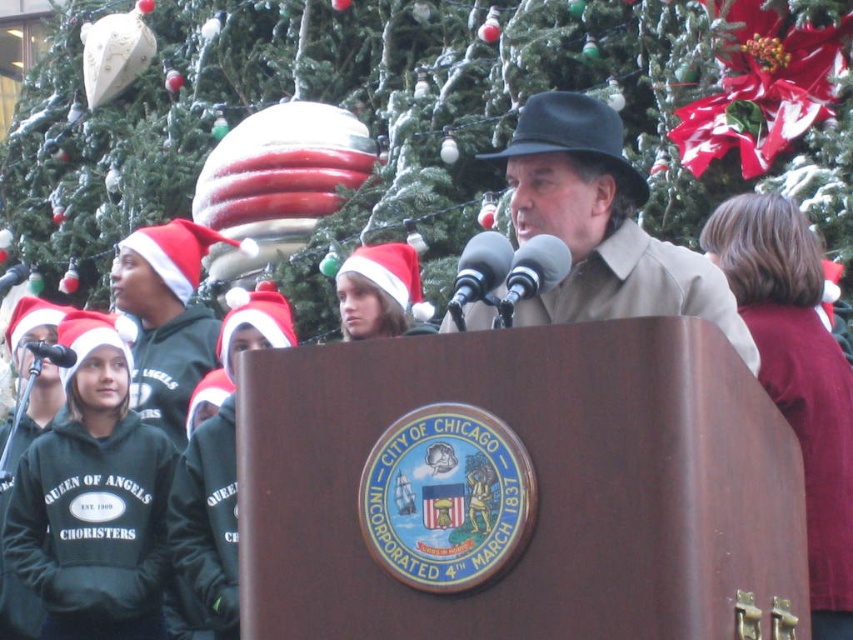
Is point (433, 244) positioned behind point (57, 360)?

Yes, it is.

Between green textured christmas tree at upper center and black matte microphone at left, which one is positioned lower?

black matte microphone at left

Between point (283, 26) and point (39, 346), which one is positioned in front?

Point (39, 346)

Find the location of a particular element. green textured christmas tree at upper center is located at coordinates 347,108.

Who is positioned more to the left, white fabric santa hat at left or black felt hat at center?

Positioned to the left is white fabric santa hat at left.

Does point (149, 403) lie in front of point (537, 104)?

No, it is behind (537, 104).

Who is more forward, (x=196, y=376) or (x=593, y=124)?

Point (x=593, y=124)

I want to click on white fabric santa hat at left, so click(x=166, y=317).

Who is lower down, matte brown coat at center or white fabric santa hat at left?

white fabric santa hat at left

Locate an element on the screen. matte brown coat at center is located at coordinates (602, 225).